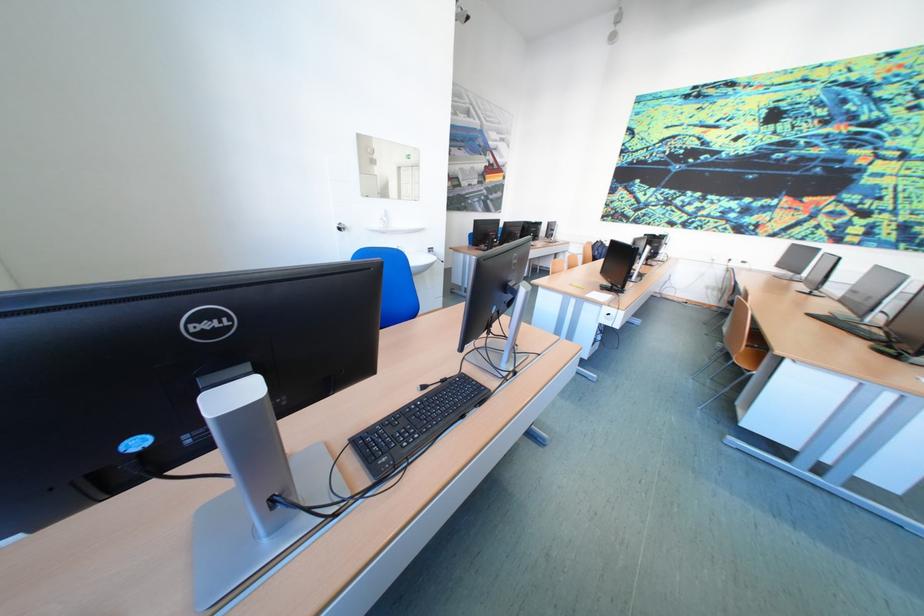
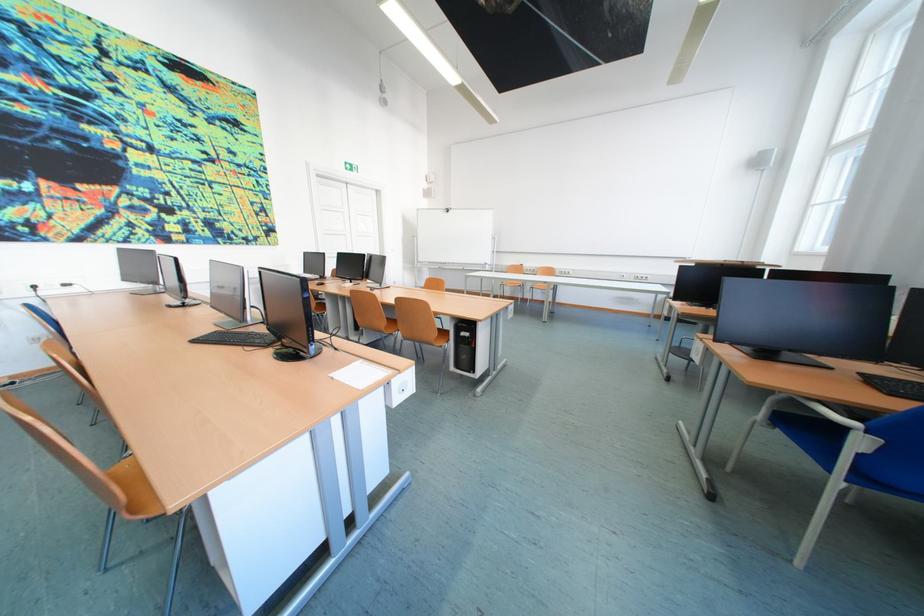
Question: I am providing you with two images of the same scene from different viewpoints. Which of the following objects are not visible in image2?

Choices:
 (A) black computer keyboard
 (B) orange chair sitting surface
 (C) white piece of paper
 (D) none of these

Answer: (D)